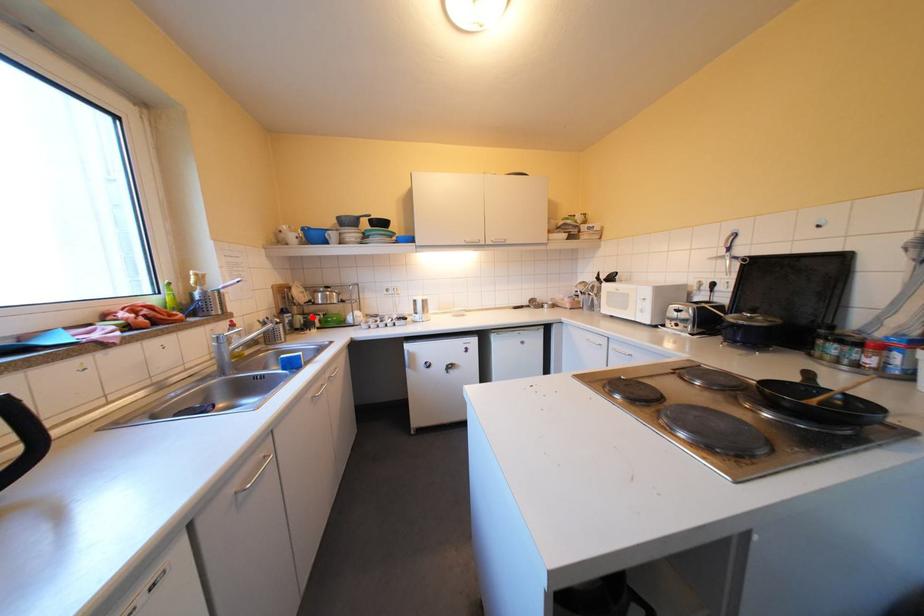
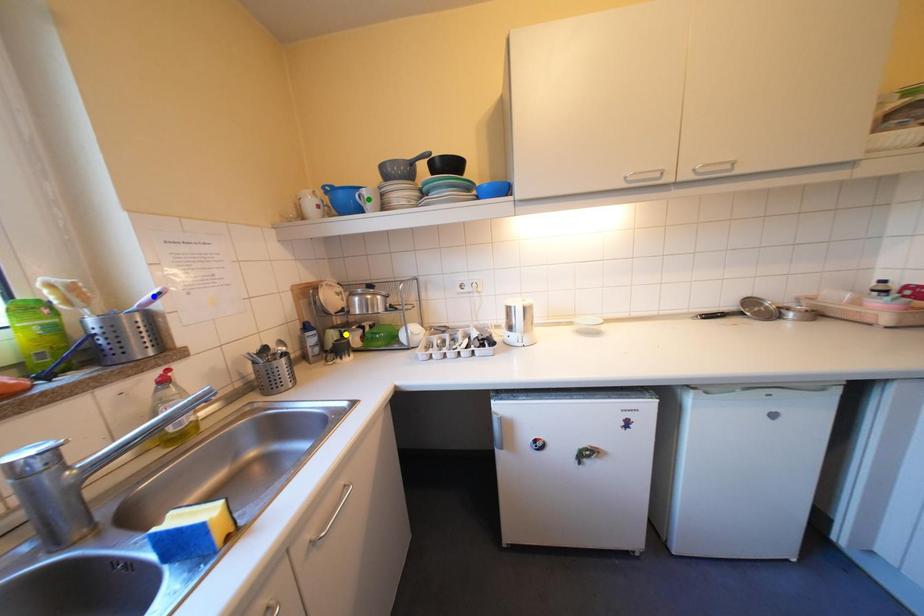
Question: I am providing you with two images of the same scene from different viewpoints. A red point is marked on the first image. You are given multiple points on the second image. Which point in image 2 represents the same 3d spot as the red point in image 1?

Choices:
 (A) green point
 (B) yellow point
 (C) blue point

Answer: (B)